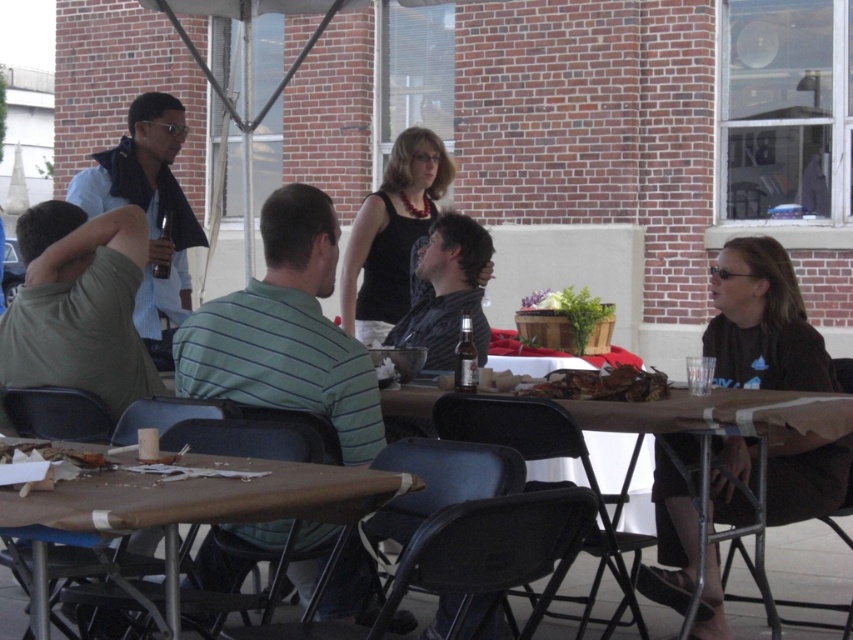
You are a photographer trying to capture a photo of both the light blue shirt at left and the shiny metallic crab at center. Since you want both subjects to be in focus, you need to know which one is closer to the camera. Can you determine which is closer?

The light blue shirt at left is taller than the shiny metallic crab at center, which means the light blue shirt at left is closer to the camera.

Based on the photo, you are organizing a photo shoot and want to ensure that the light blue shirt at left and the shiny metallic crab at center are visible in the frame. Based on their sizes, which object should you prioritize focusing on to ensure it takes up more space in the photo?

The light blue shirt at left should be prioritized for focus since its width is larger than the shiny metallic crab at center, meaning it occupies more space in the frame.